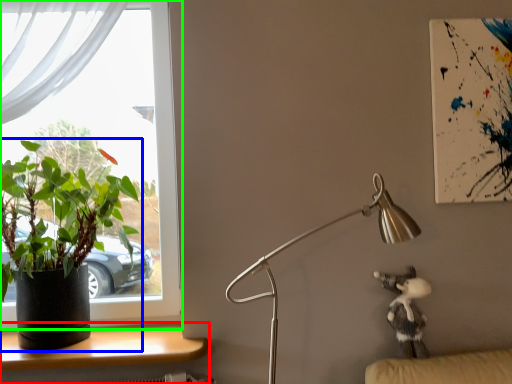
Question: Which object is the closest to the desk (highlighted by a red box)? Choose among these: houseplant (highlighted by a blue box) or window (highlighted by a green box).

Choices:
 (A) houseplant
 (B) window

Answer: (A)